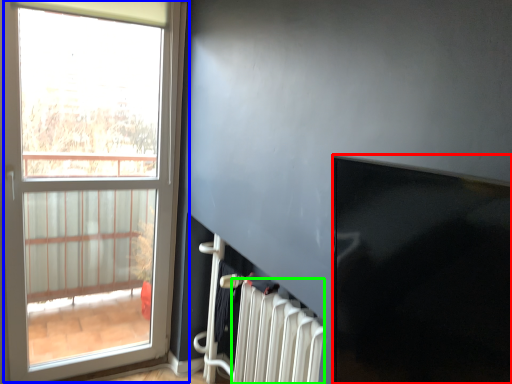
Question: Considering the real-world distances, which object is closest to window screen (highlighted by a red box)? window (highlighted by a blue box) or radiator (highlighted by a green box).

Choices:
 (A) window
 (B) radiator

Answer: (B)